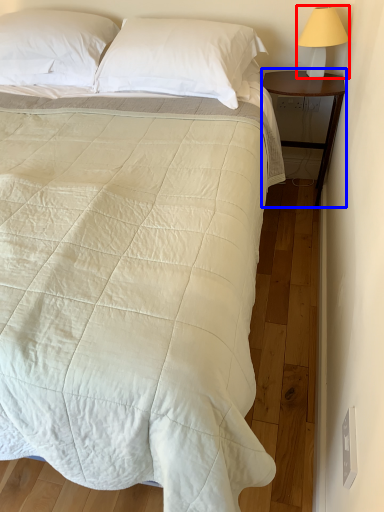
Question: Among these objects, which one is farthest to the camera, bedside lamp (highlighted by a red box) or nightstand (highlighted by a blue box)?

Choices:
 (A) bedside lamp
 (B) nightstand

Answer: (B)